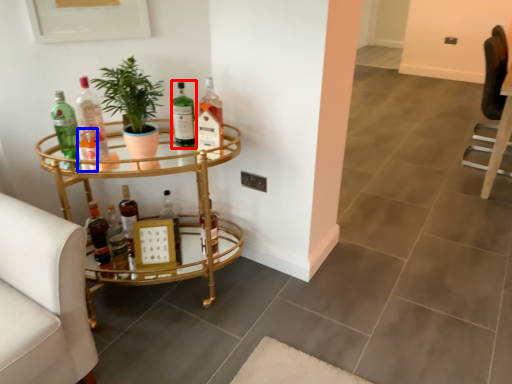
Question: Among these objects, which one is farthest to the camera, bottle (highlighted by a red box) or bottle (highlighted by a blue box)?

Choices:
 (A) bottle
 (B) bottle

Answer: (A)